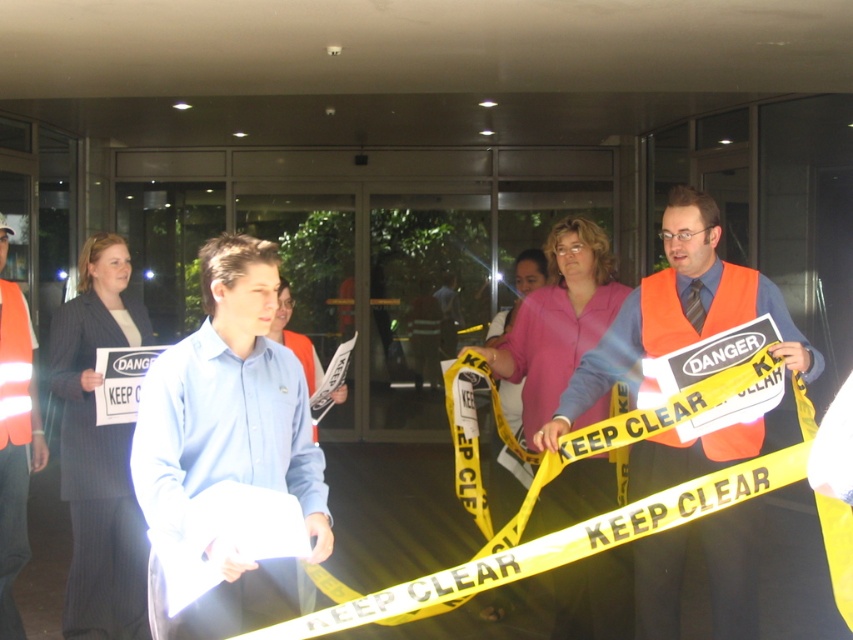
Is blue shirt at center positioned behind high-visibility reflective vest at center?

No.

Is point (245, 433) positioned in front of point (0, 221)?

That is True.

This screenshot has width=853, height=640. What do you see at coordinates (227, 444) in the screenshot?
I see `blue shirt at center` at bounding box center [227, 444].

You are a GUI agent. You are given a task and a screenshot of the screen. Output one action in this format:
    pyautogui.click(x=<x>, y=<y>)
    Task: Click on the blue shirt at center
    The image size is (853, 640).
    Given the screenshot: What is the action you would take?
    pyautogui.click(x=227, y=444)

Is blue shirt at center closer to camera compared to orange reflective vest at center?

Yes, it is.

Is blue shirt at center smaller than orange reflective vest at center?

Yes, blue shirt at center is smaller than orange reflective vest at center.

The image size is (853, 640). What do you see at coordinates (227, 444) in the screenshot?
I see `blue shirt at center` at bounding box center [227, 444].

Where is `blue shirt at center`? This screenshot has height=640, width=853. blue shirt at center is located at coordinates (227, 444).

Does point (724, 266) come farther from viewer compared to point (9, 358)?

No, it is not.

Can you confirm if orange reflective vest at center is positioned to the right of high-visibility reflective vest at center?

Correct, you'll find orange reflective vest at center to the right of high-visibility reflective vest at center.

Does point (741, 598) lie in front of point (32, 388)?

That is True.

Where is `orange reflective vest at center`? The width and height of the screenshot is (853, 640). orange reflective vest at center is located at coordinates (679, 310).